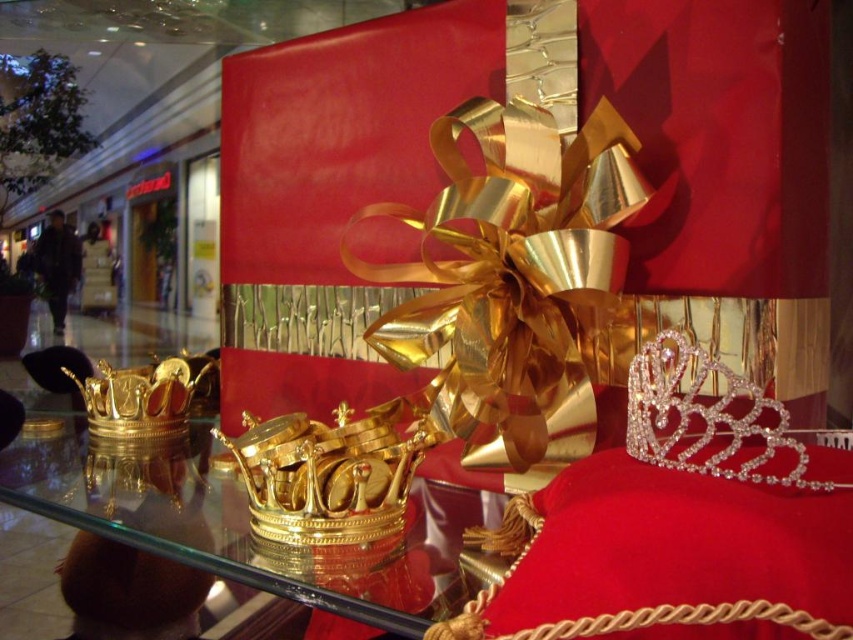
Based on the photo, between clear crystal tiara at upper right and gold shiny crown at left, which one has more height?

Standing taller between the two is gold shiny crown at left.

Which is above, clear crystal tiara at upper right or gold shiny crown at left?

clear crystal tiara at upper right is above.

In order to click on clear crystal tiara at upper right in this screenshot , I will do `click(709, 419)`.

Where is `clear crystal tiara at upper right`? The width and height of the screenshot is (853, 640). clear crystal tiara at upper right is located at coordinates (709, 419).

Is transparent glass crown at center closer to the viewer compared to gold shiny crown at left?

Yes, it is in front of gold shiny crown at left.

What do you see at coordinates (212, 536) in the screenshot? I see `transparent glass crown at center` at bounding box center [212, 536].

The height and width of the screenshot is (640, 853). I want to click on transparent glass crown at center, so click(212, 536).

Is the position of gold shiny crown at center less distant than that of gold shiny crown at left?

Yes.

Is point (245, 432) farther from camera compared to point (157, 364)?

No, it is not.

Does point (250, 513) come closer to viewer compared to point (93, 376)?

Yes, it is in front of point (93, 376).

You are a GUI agent. You are given a task and a screenshot of the screen. Output one action in this format:
    pyautogui.click(x=<x>, y=<y>)
    Task: Click on the gold shiny crown at center
    The width and height of the screenshot is (853, 640).
    Given the screenshot: What is the action you would take?
    click(325, 476)